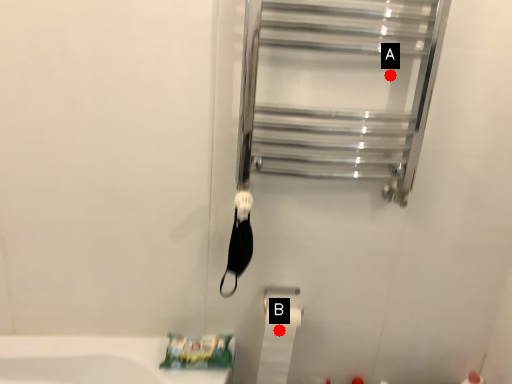
Question: Two points are circled on the image, labeled by A and B beside each circle. Which of the following is the closest to the observer?

Choices:
 (A) A is closer
 (B) B is closer

Answer: (A)